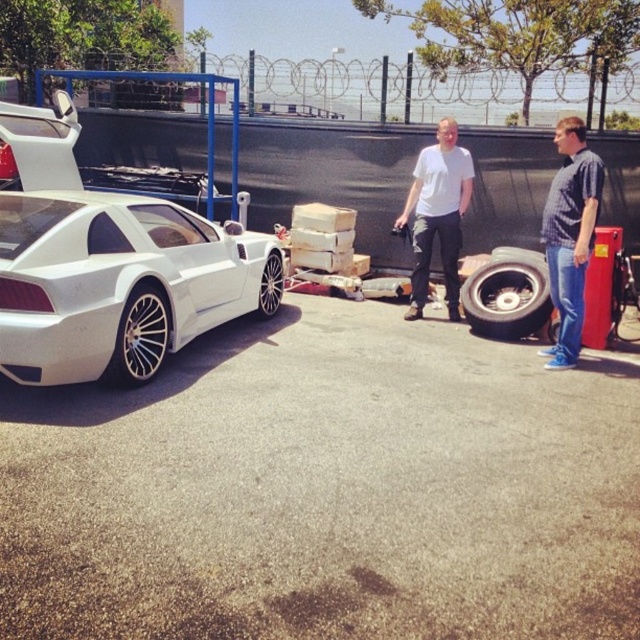
Between white matte sports car at left and blue plaid shirt at right, which one has more height?

With more height is blue plaid shirt at right.

Locate an element on the screen. Image resolution: width=640 pixels, height=640 pixels. white matte sports car at left is located at coordinates (109, 266).

Locate an element on the screen. white matte sports car at left is located at coordinates (109, 266).

The image size is (640, 640). What are the coordinates of `white matte sports car at left` in the screenshot? It's located at (109, 266).

From the picture: Who is lower down, white matte sports car at left or white matte shirt at center?

Positioned lower is white matte sports car at left.

Where is `white matte sports car at left`? The width and height of the screenshot is (640, 640). white matte sports car at left is located at coordinates (109, 266).

Find the location of a particular element. This screenshot has width=640, height=640. white matte sports car at left is located at coordinates (109, 266).

Based on the photo, between blue plaid shirt at right and white matte shirt at center, which one is positioned lower?

blue plaid shirt at right is lower down.

The image size is (640, 640). What are the coordinates of `blue plaid shirt at right` in the screenshot? It's located at (570, 236).

Is point (556, 262) farther from viewer compared to point (417, 193)?

No.

This screenshot has width=640, height=640. Find the location of `blue plaid shirt at right`. blue plaid shirt at right is located at coordinates (570, 236).